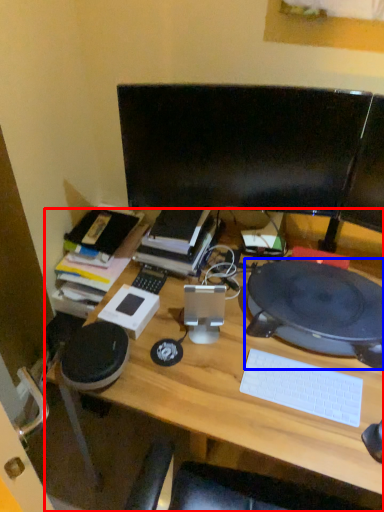
Question: Which object is further to the camera taking this photo, desk (highlighted by a red box) or computer (highlighted by a blue box)?

Choices:
 (A) desk
 (B) computer

Answer: (B)